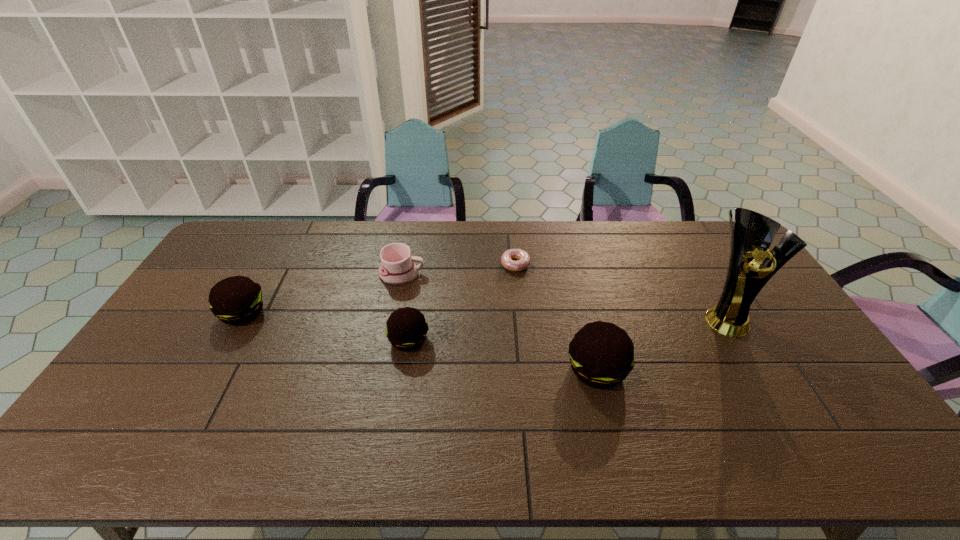
What are the coordinates of `the leftmost object` in the screenshot? It's located at (236, 300).

This screenshot has width=960, height=540. What are the coordinates of `the second shortest patty` in the screenshot? It's located at (236, 300).

Locate an element on the screen. The width and height of the screenshot is (960, 540). the second patty from right to left is located at coordinates (406, 330).

This screenshot has height=540, width=960. Identify the location of the fifth object from left to right. (601, 354).

Where is `award`? This screenshot has width=960, height=540. award is located at coordinates (751, 235).

Locate an element on the screen. the tallest object is located at coordinates (751, 235).

Locate an element on the screen. The width and height of the screenshot is (960, 540). mug is located at coordinates (397, 267).

What are the coordinates of `the shortest object` in the screenshot? It's located at (523, 259).

The width and height of the screenshot is (960, 540). In order to click on the third object from right to left in this screenshot , I will do `click(523, 259)`.

Where is `vacant space located on the front of the second shortest patty`? This screenshot has height=540, width=960. vacant space located on the front of the second shortest patty is located at coordinates 194,401.